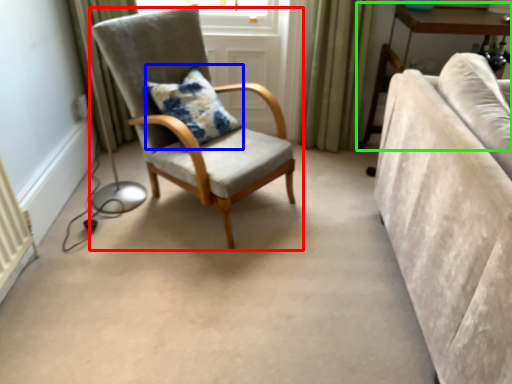
Question: Estimate the real-world distances between objects in this image. Which object is farther from chair (highlighted by a red box), pillow (highlighted by a blue box) or table (highlighted by a green box)?

Choices:
 (A) pillow
 (B) table

Answer: (B)